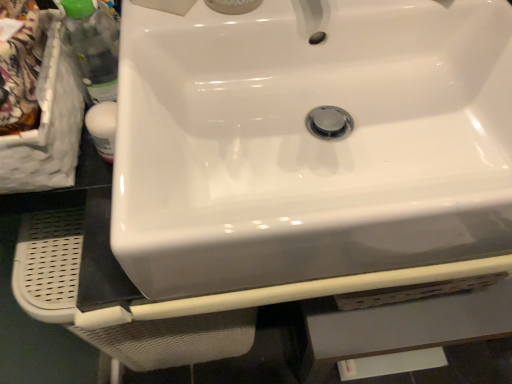
The width and height of the screenshot is (512, 384). Describe the element at coordinates (93, 47) in the screenshot. I see `translucent plastic bottle at left` at that location.

This screenshot has width=512, height=384. In order to click on translucent plastic bottle at left in this screenshot , I will do `click(93, 47)`.

Describe the element at coordinates (310, 142) in the screenshot. This screenshot has width=512, height=384. I see `white glossy sink at center` at that location.

You are a GUI agent. You are given a task and a screenshot of the screen. Output one action in this format:
    pyautogui.click(x=<x>, y=<y>)
    Task: Click on the white glossy sink at center
    
    Given the screenshot: What is the action you would take?
    pyautogui.click(x=310, y=142)

You are a GUI agent. You are given a task and a screenshot of the screen. Output one action in this format:
    pyautogui.click(x=<x>, y=<y>)
    Task: Click on the translucent plastic bottle at left
    
    Given the screenshot: What is the action you would take?
    pyautogui.click(x=93, y=47)

Looking at this image, considering the relative positions of white glossy sink at center and translucent plastic bottle at left in the image provided, is white glossy sink at center to the left of translucent plastic bottle at left from the viewer's perspective?

Incorrect, white glossy sink at center is not on the left side of translucent plastic bottle at left.

Does white glossy sink at center come in front of translucent plastic bottle at left?

Yes, white glossy sink at center is closer to the camera.

Is point (466, 143) closer or farther from the camera than point (68, 8)?

Point (466, 143) is positioned farther from the camera compared to point (68, 8).

From the image's perspective, is white glossy sink at center located above or below translucent plastic bottle at left?

Based on their image positions, white glossy sink at center is located beneath translucent plastic bottle at left.

From a real-world perspective, is white glossy sink at center over translucent plastic bottle at left?

No, from a real-world perspective, white glossy sink at center is not over translucent plastic bottle at left

Which of these two, white glossy sink at center or translucent plastic bottle at left, is thinner?

With smaller width is translucent plastic bottle at left.

In terms of height, does white glossy sink at center look taller or shorter compared to translucent plastic bottle at left?

Considering their sizes, white glossy sink at center has less height than translucent plastic bottle at left.

Considering the sizes of white glossy sink at center and translucent plastic bottle at left in the image, is white glossy sink at center bigger or smaller than translucent plastic bottle at left?

Clearly, white glossy sink at center is larger in size than translucent plastic bottle at left.

Do you think white glossy sink at center is within translucent plastic bottle at left, or outside of it?

white glossy sink at center is spatially situated outside translucent plastic bottle at left.

Is white glossy sink at center far away from translucent plastic bottle at left?

white glossy sink at center is near translucent plastic bottle at left, not far away.

Is white glossy sink at center turned away from translucent plastic bottle at left?

No, translucent plastic bottle at left is not at the back of white glossy sink at center.

Can you tell me how much white glossy sink at center and translucent plastic bottle at left differ in facing direction?

The angle between the facing direction of white glossy sink at center and the facing direction of translucent plastic bottle at left is 2.17 degrees.

Find the location of a particular element. This screenshot has height=384, width=512. bottle on the left of white glossy sink at center is located at coordinates (x=93, y=47).

Is translucent plastic bottle at left at the left side of white glossy sink at center?

Correct, you'll find translucent plastic bottle at left to the left of white glossy sink at center.

Between translucent plastic bottle at left and white glossy sink at center, which one is positioned behind?

Positioned behind is translucent plastic bottle at left.

Considering the positions of points (73, 19) and (496, 158), is point (73, 19) farther from camera compared to point (496, 158)?

That is True.

From the image's perspective, does translucent plastic bottle at left appear higher than white glossy sink at center?

Correct, translucent plastic bottle at left appears higher than white glossy sink at center in the image.

From a real-world perspective, is translucent plastic bottle at left positioned under white glossy sink at center based on gravity?

No, from a real-world perspective, translucent plastic bottle at left is not below white glossy sink at center.

Does translucent plastic bottle at left have a lesser width compared to white glossy sink at center?

Correct, the width of translucent plastic bottle at left is less than that of white glossy sink at center.

In terms of height, does translucent plastic bottle at left look taller or shorter compared to white glossy sink at center?

translucent plastic bottle at left is taller than white glossy sink at center.

Based on their sizes in the image, would you say translucent plastic bottle at left is bigger or smaller than white glossy sink at center?

In the image, translucent plastic bottle at left appears to be smaller than white glossy sink at center.

Consider the image. Is translucent plastic bottle at left inside or outside of white glossy sink at center?

translucent plastic bottle at left is outside white glossy sink at center.

Would you say translucent plastic bottle at left is a long distance from white glossy sink at center?

translucent plastic bottle at left is near white glossy sink at center, not far away.

Is translucent plastic bottle at left oriented away from white glossy sink at center?

translucent plastic bottle at left is not turned away from white glossy sink at center.

Measure the distance from translucent plastic bottle at left to white glossy sink at center.

They are 25.84 centimeters apart.

Identify the location of sink in front of the translucent plastic bottle at left. The image size is (512, 384). (310, 142).

Find the location of `bottle that appears behind the white glossy sink at center`. bottle that appears behind the white glossy sink at center is located at coordinates (93, 47).

In order to click on sink directly beneath the translucent plastic bottle at left (from a real-world perspective) in this screenshot , I will do `click(310, 142)`.